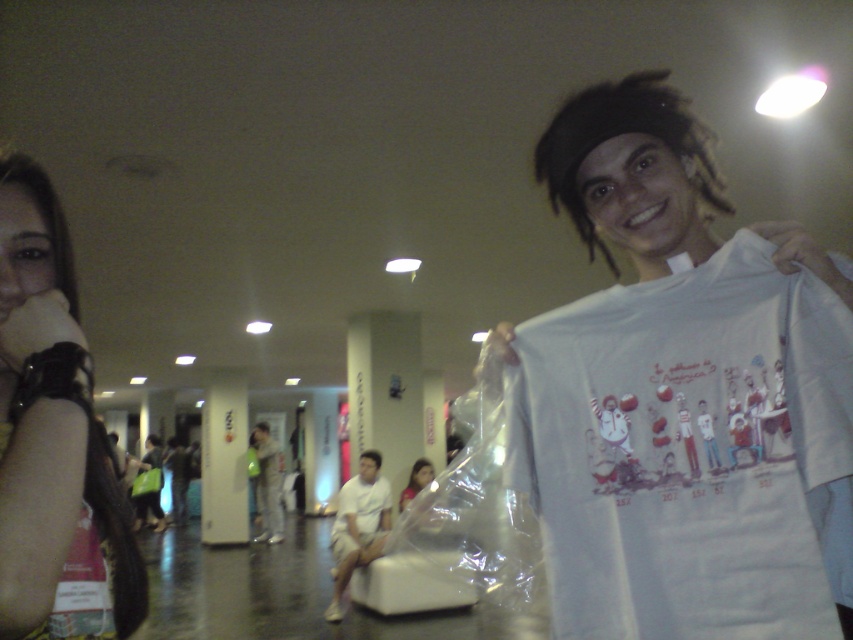
Who is higher up, light brown fabric pants at center or matte pink shirt at center?

matte pink shirt at center is higher up.

Does light brown fabric pants at center come behind matte pink shirt at center?

That is True.

Where is `light brown fabric pants at center`? light brown fabric pants at center is located at coordinates (268, 484).

Can you confirm if white cotton t-shirt at right is taller than black leather bracelet at upper left?

No.

Does white cotton t-shirt at right appear on the right side of black leather bracelet at upper left?

Yes, white cotton t-shirt at right is to the right of black leather bracelet at upper left.

Between point (728, 358) and point (9, 550), which one is positioned behind?

The point (728, 358) is more distant.

I want to click on white cotton t-shirt at right, so click(x=685, y=449).

Which is below, black leather bracelet at upper left or light brown fabric pants at center?

light brown fabric pants at center

Is the position of black leather bracelet at upper left less distant than that of light brown fabric pants at center?

Yes.

Find the location of a particular element. This screenshot has width=853, height=640. black leather bracelet at upper left is located at coordinates (53, 436).